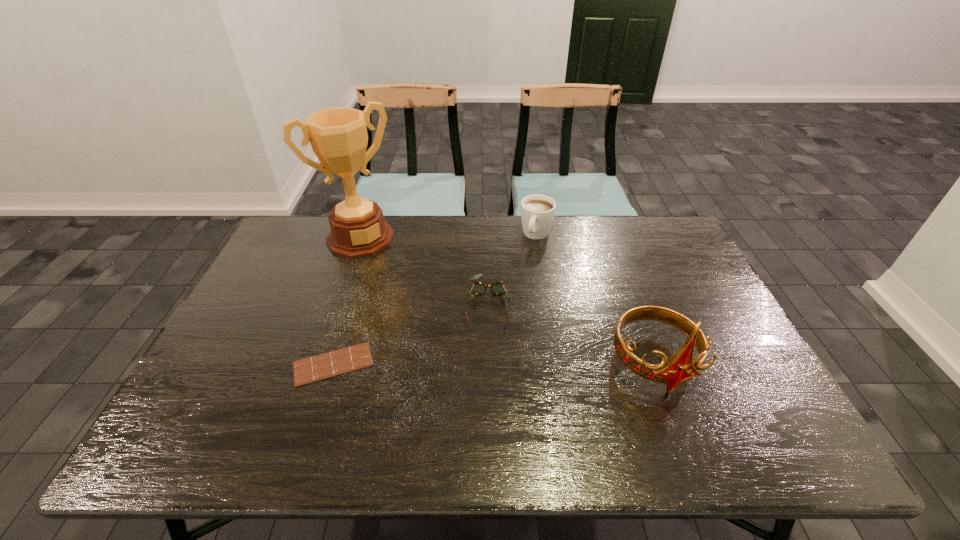
This screenshot has height=540, width=960. What are the coordinates of `vacant space that is in between the spectacles and the third shortest object` in the screenshot? It's located at (512, 269).

At what (x,y) coordinates should I click in order to perform the action: click on unoccupied position between the second tallest object and the chocolate bar. Please return your answer as a coordinate pair (x, y). Looking at the image, I should click on (493, 363).

Locate which object is the third closest to the cappuccino. Please provide its 2D coordinates. Your answer should be formatted as a tuple, i.e. [(x, y)], where the tuple contains the x and y coordinates of a point satisfying the conditions above.

[(338, 136)]

Where is `object that stands as the closest to the fourth object from left to right`? object that stands as the closest to the fourth object from left to right is located at coordinates (497, 288).

Image resolution: width=960 pixels, height=540 pixels. Identify the location of vacant space that satisfies the following two spatial constraints: 1. on the back side of the fourth object from left to right; 2. on the right side of the chocolate bar. (373, 235).